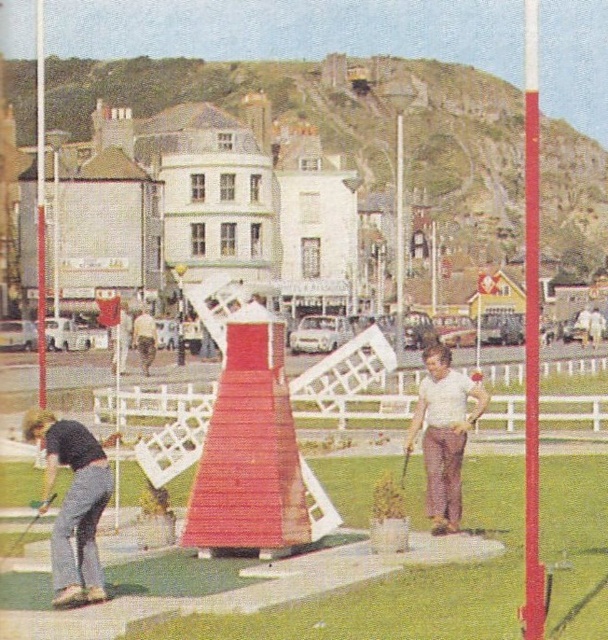
Is white matte golf club at center bigger than wooden golf club at lower left?

Yes.

Is white matte golf club at center below wooden golf club at lower left?

Incorrect, white matte golf club at center is not positioned below wooden golf club at lower left.

Which is in front, point (449, 358) or point (15, 545)?

Point (15, 545)

This screenshot has height=640, width=608. I want to click on white matte golf club at center, so click(x=443, y=433).

Is point (567, 476) in front of point (536, 264)?

That is False.

Is wooden windmill at center smaller than smooth red pole at right?

Correct, wooden windmill at center occupies less space than smooth red pole at right.

Identify the location of wooden windmill at center. The image size is (608, 640). (409, 586).

Between wooden windmill at center and dark gray pants at lower left, which one is positioned higher?

Positioned higher is dark gray pants at lower left.

Does wooden windmill at center have a smaller size compared to dark gray pants at lower left?

No.

At what (x,y) coordinates should I click in order to perform the action: click on wooden windmill at center. Please return your answer as a coordinate pair (x, y). The height and width of the screenshot is (640, 608). Looking at the image, I should click on (409, 586).